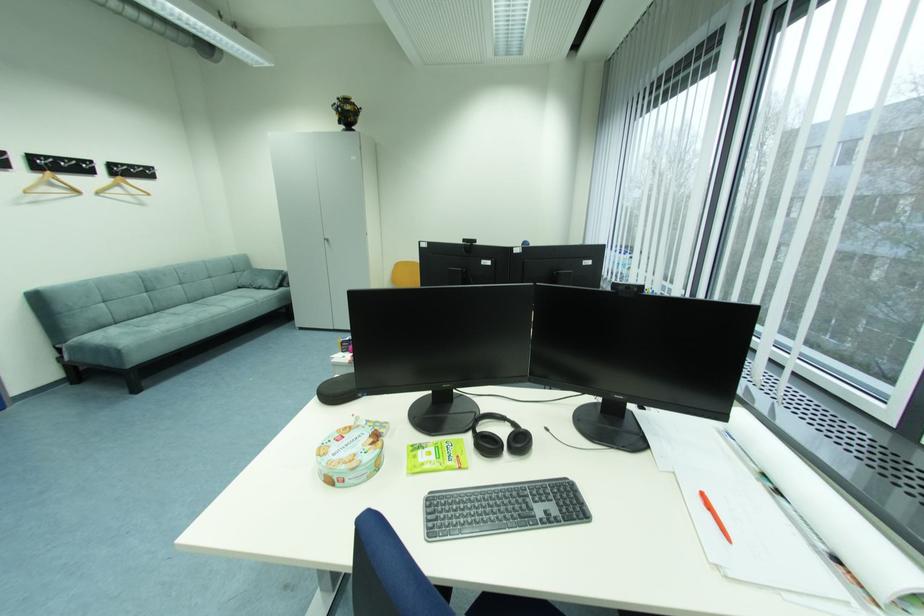
The image size is (924, 616). Find the location of `sofa armrest`. sofa armrest is located at coordinates (259, 278).